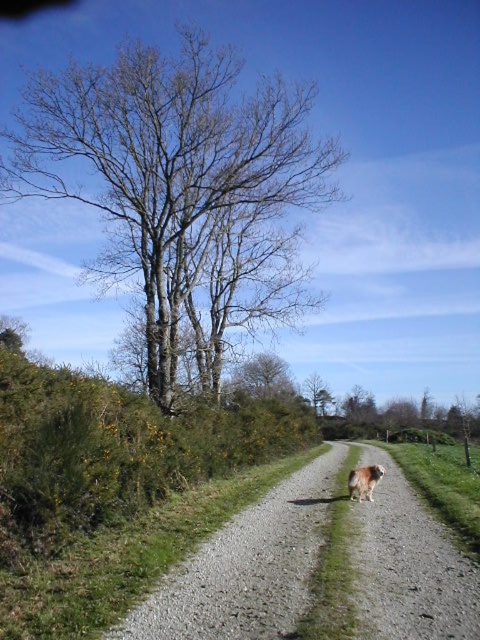
Question: Observing the image, what is the correct spatial positioning of gravelly dirt road at center in reference to brown leafless tree at upper center?

Choices:
 (A) right
 (B) left

Answer: (B)

Question: Which object is the farthest from the brown leafless tree at upper center?

Choices:
 (A) gravelly dirt road at center
 (B) brown fluffy dog at right
 (C) bare wood tree at upper left

Answer: (B)

Question: Based on their relative distances, which object is farther from the gravelly dirt road at center?

Choices:
 (A) brown leafless tree at upper center
 (B) bare wood tree at upper left
 (C) brown fluffy dog at right

Answer: (A)

Question: Does gravelly dirt road at center have a lesser width compared to brown fluffy dog at right?

Choices:
 (A) no
 (B) yes

Answer: (A)

Question: Which object is farther from the camera taking this photo?

Choices:
 (A) gravelly dirt road at center
 (B) brown fluffy dog at right

Answer: (B)

Question: Is gravelly dirt road at center positioned in front of brown leafless tree at upper center?

Choices:
 (A) no
 (B) yes

Answer: (B)